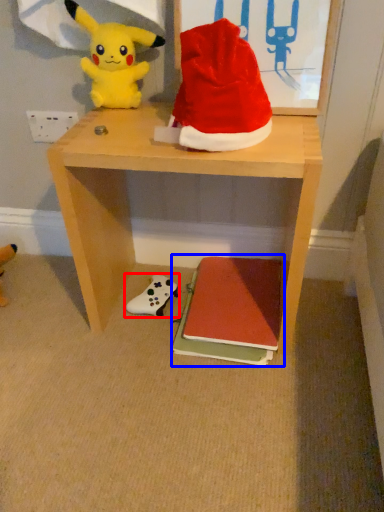
Question: Which point is closer to the camera, toy (highlighted by a red box) or book (highlighted by a blue box)?

Choices:
 (A) toy
 (B) book

Answer: (B)